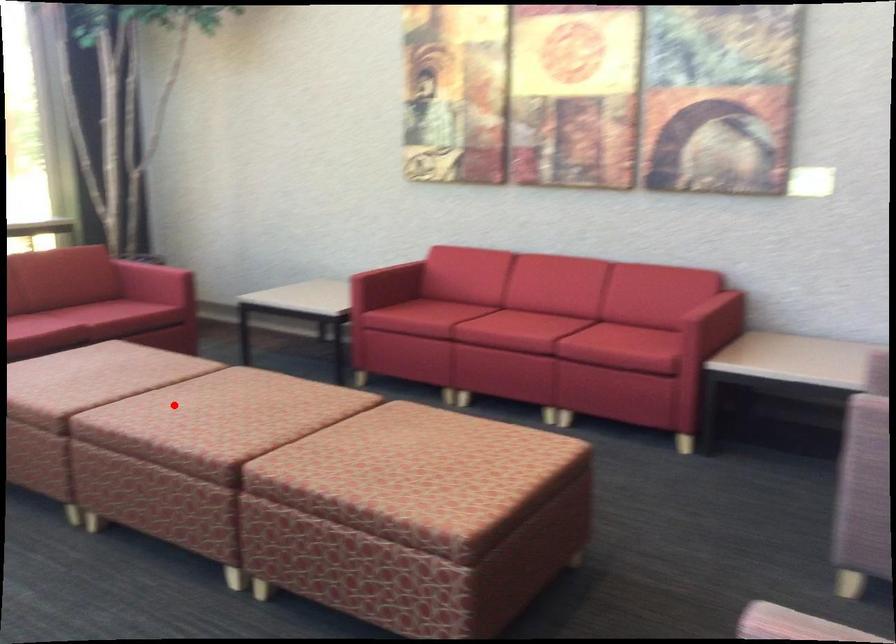
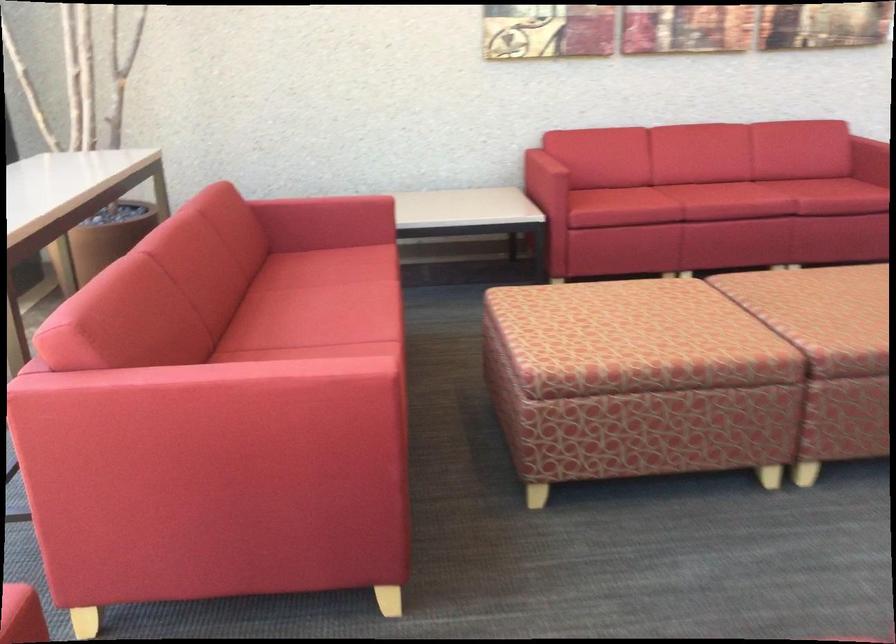
Question: I am providing you with two images of the same scene from different viewpoints. In image1, a red point is highlighted. Considering the same 3D point in image2, which of the following is correct?

Choices:
 (A) It is closer
 (B) It is farther

Answer: (A)